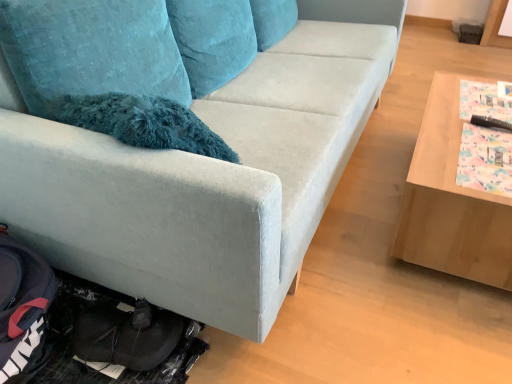
Question: From a real-world perspective, is light brown wooden table at right positioned above or below velvet blue couch at center?

Choices:
 (A) above
 (B) below

Answer: (B)

Question: Looking at the image, does light brown wooden table at right seem bigger or smaller compared to velvet blue couch at center?

Choices:
 (A) big
 (B) small

Answer: (B)

Question: Considering the positions of point (480, 258) and point (285, 99), is point (480, 258) closer or farther from the camera than point (285, 99)?

Choices:
 (A) farther
 (B) closer

Answer: (B)

Question: Based on their positions, is velvet blue couch at center located to the left or right of light brown wooden table at right?

Choices:
 (A) right
 (B) left

Answer: (B)

Question: Is velvet blue couch at center situated inside light brown wooden table at right or outside?

Choices:
 (A) inside
 (B) outside

Answer: (B)

Question: In terms of width, does velvet blue couch at center look wider or thinner when compared to light brown wooden table at right?

Choices:
 (A) thin
 (B) wide

Answer: (B)

Question: Is velvet blue couch at center taller or shorter than light brown wooden table at right?

Choices:
 (A) tall
 (B) short

Answer: (A)